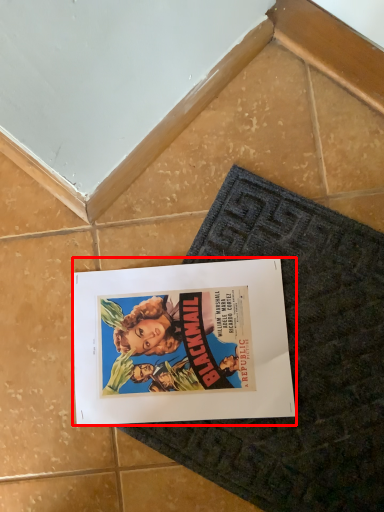
Question: In this image, where is poster (annotated by the red box) located relative to bath mat?

Choices:
 (A) right
 (B) left

Answer: (B)